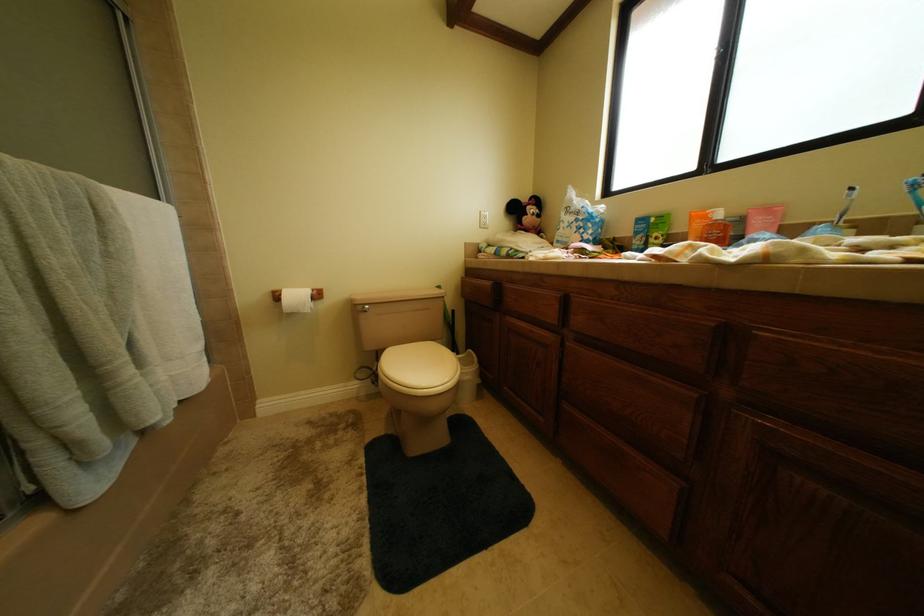
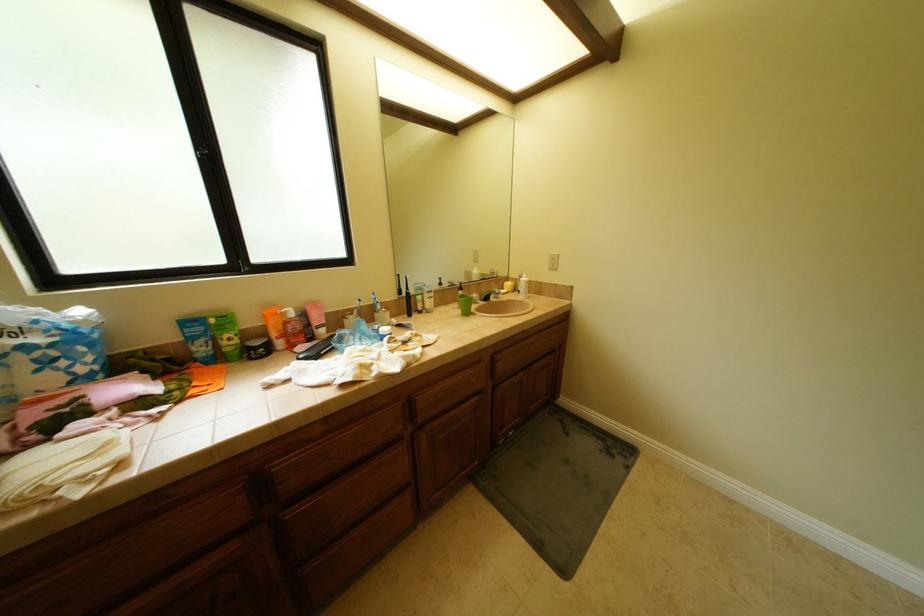
From the picture: The images are taken continuously from a first-person perspective. In which direction is your viewpoint rotating?

The camera's rotation is toward right-down.